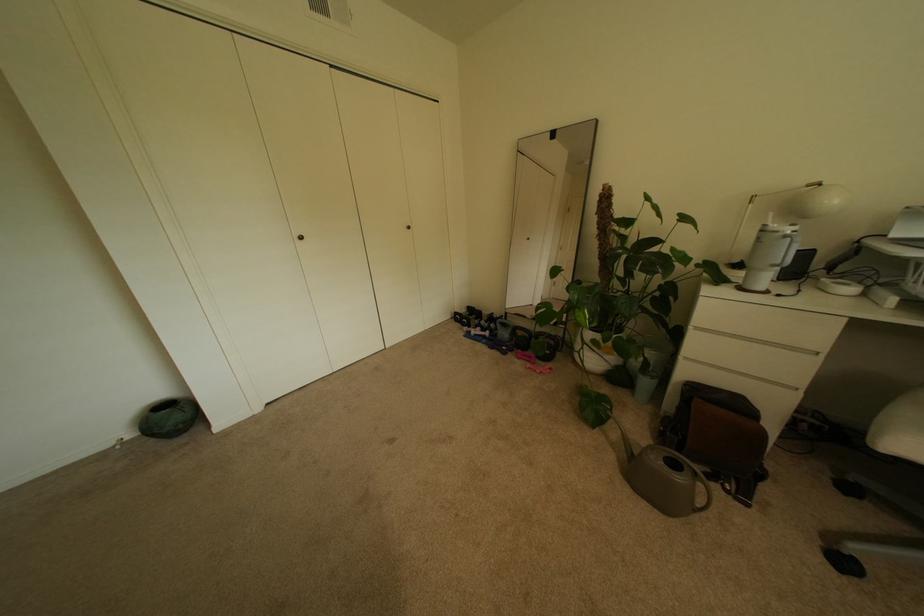
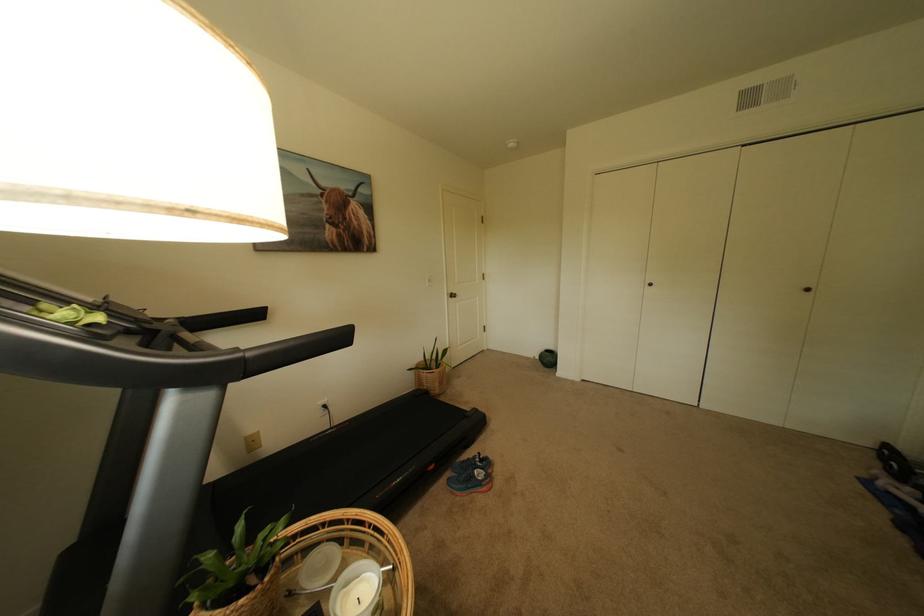
Question: The camera is either moving clockwise (left) or counter-clockwise (right) around the object. The first image is from the beginning of the video and the second image is from the end. Is the camera moving left or right when shooting the video?

Choices:
 (A) Left
 (B) Right

Answer: (B)